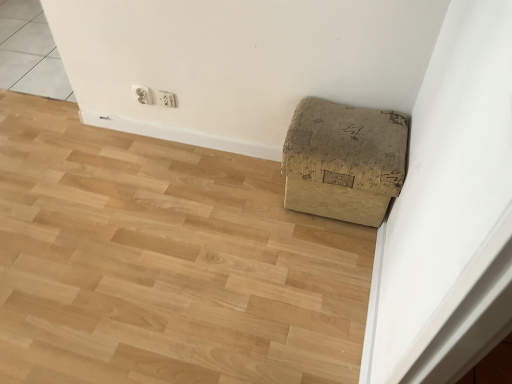
Question: Is white plastic electric outlet at upper center, the first electric outlet in the right-to-left sequence, placed right next to brown cardboard box at lower right?

Choices:
 (A) yes
 (B) no

Answer: (B)

Question: From the image's perspective, does white plastic electric outlet at upper center, the first electric outlet in the right-to-left sequence, appear lower than brown cardboard box at lower right?

Choices:
 (A) yes
 (B) no

Answer: (B)

Question: Is white plastic electric outlet at upper center, the 2th electric outlet from the left, thinner than brown cardboard box at lower right?

Choices:
 (A) yes
 (B) no

Answer: (A)

Question: Is white plastic electric outlet at upper center, the 2th electric outlet from the left, facing towards brown cardboard box at lower right?

Choices:
 (A) yes
 (B) no

Answer: (B)

Question: From a real-world perspective, is white plastic electric outlet at upper center, the 2th electric outlet from the left, below brown cardboard box at lower right?

Choices:
 (A) yes
 (B) no

Answer: (B)

Question: From the image's perspective, relative to brown cardboard box at lower right, is brown cardboard box at lower right above or below?

Choices:
 (A) below
 (B) above

Answer: (B)

Question: Does point (142, 276) appear closer or farther from the camera than point (338, 200)?

Choices:
 (A) closer
 (B) farther

Answer: (A)

Question: Visually, is brown cardboard box at lower right positioned to the left or to the right of brown cardboard box at lower right?

Choices:
 (A) right
 (B) left

Answer: (B)

Question: Do you think brown cardboard box at lower right is within brown cardboard box at lower right, or outside of it?

Choices:
 (A) outside
 (B) inside

Answer: (A)

Question: Is white plastic electric outlet at upper center, positioned as the 2th electric outlet in right-to-left order, in front of or behind brown cardboard box at lower right in the image?

Choices:
 (A) front
 (B) behind

Answer: (B)

Question: Considering the relative positions of white plastic electric outlet at upper center, positioned as the 2th electric outlet in right-to-left order, and brown cardboard box at lower right in the image provided, is white plastic electric outlet at upper center, positioned as the 2th electric outlet in right-to-left order, to the left or to the right of brown cardboard box at lower right?

Choices:
 (A) right
 (B) left

Answer: (A)

Question: From a real-world perspective, is white plastic electric outlet at upper center, positioned as the 2th electric outlet in right-to-left order, physically located above or below brown cardboard box at lower right?

Choices:
 (A) above
 (B) below

Answer: (A)

Question: Does point (146, 97) appear closer or farther from the camera than point (238, 286)?

Choices:
 (A) farther
 (B) closer

Answer: (A)

Question: Visually, is white plastic electric outlet at upper center, the 2th electric outlet from the left, positioned to the left or to the right of brown cardboard box at lower right?

Choices:
 (A) left
 (B) right

Answer: (A)

Question: From the image's perspective, relative to brown cardboard box at lower right, is white plastic electric outlet at upper center, the 2th electric outlet from the left, above or below?

Choices:
 (A) above
 (B) below

Answer: (A)